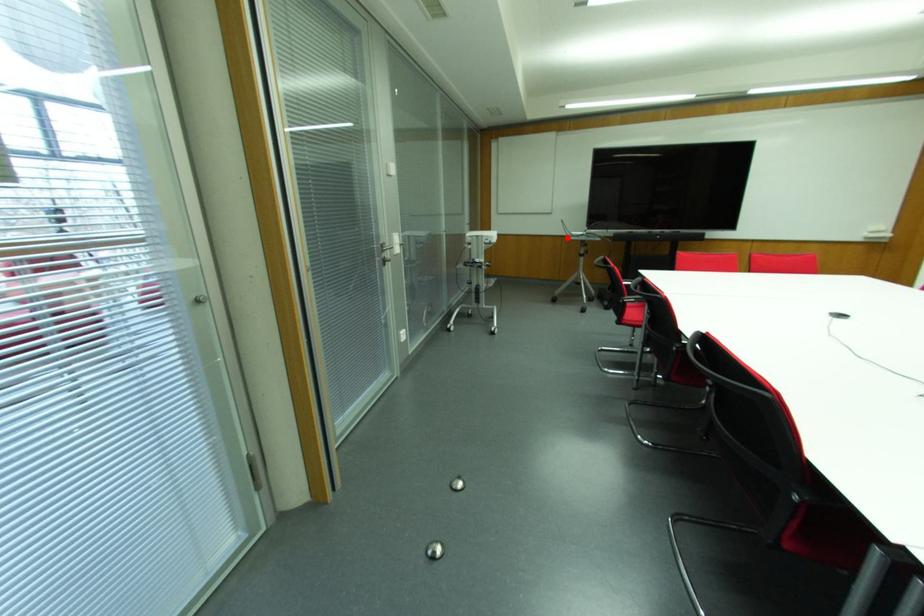
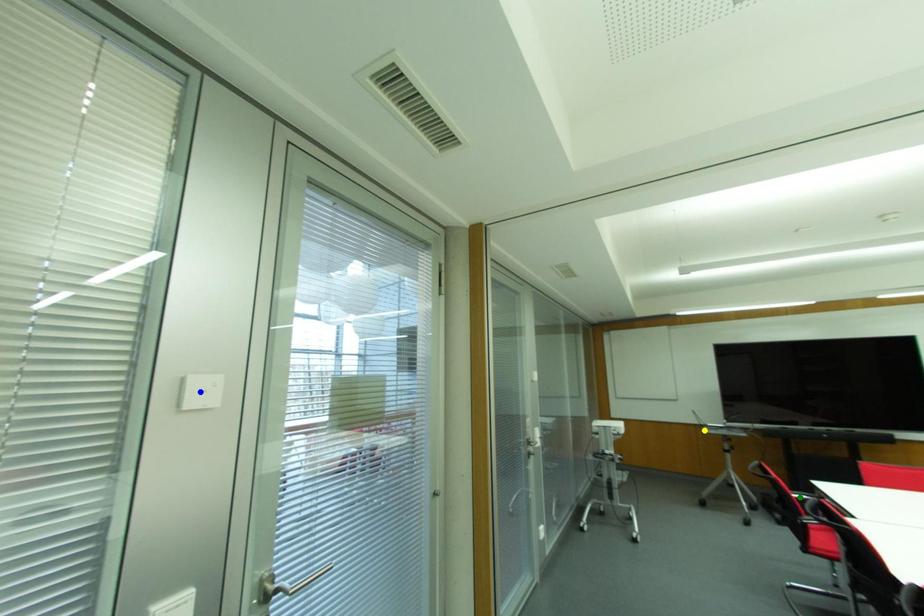
Question: I am providing you with two images of the same scene from different viewpoints. A red point is marked on the first image. You are given multiple points on the second image. Can you choose the point in image 2 that corresponds to the point in image 1?

Choices:
 (A) yellow point
 (B) blue point
 (C) green point

Answer: (A)